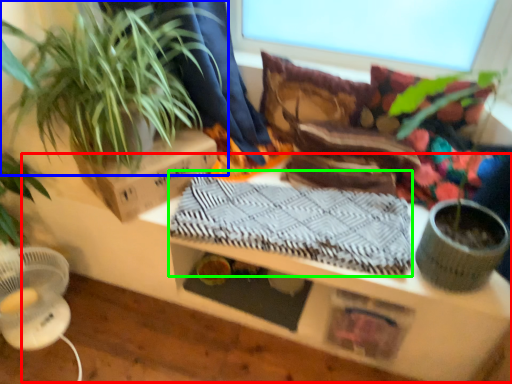
Question: Which object is the closest to the table (highlighted by a red box)? Choose among these: houseplant (highlighted by a blue box) or blanket (highlighted by a green box).

Choices:
 (A) houseplant
 (B) blanket

Answer: (B)